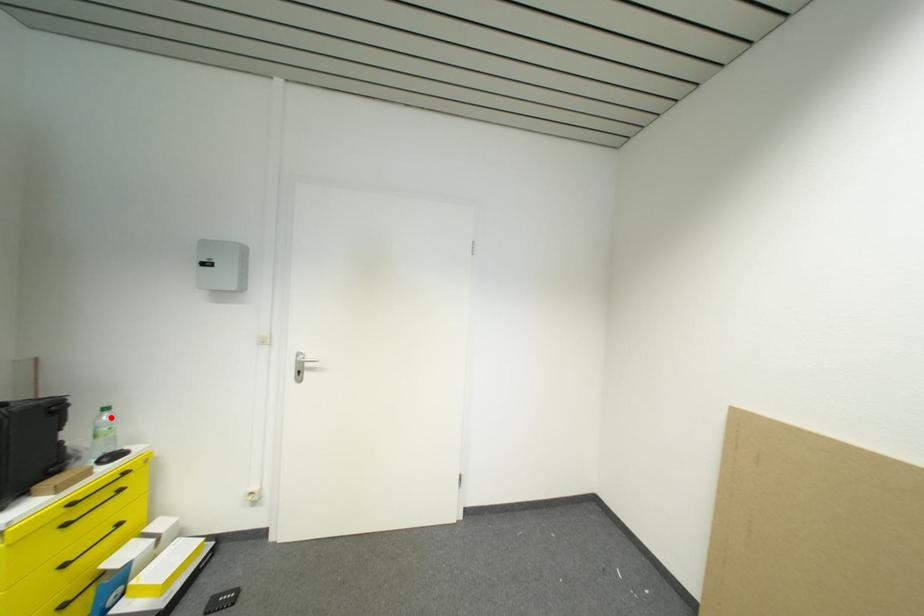
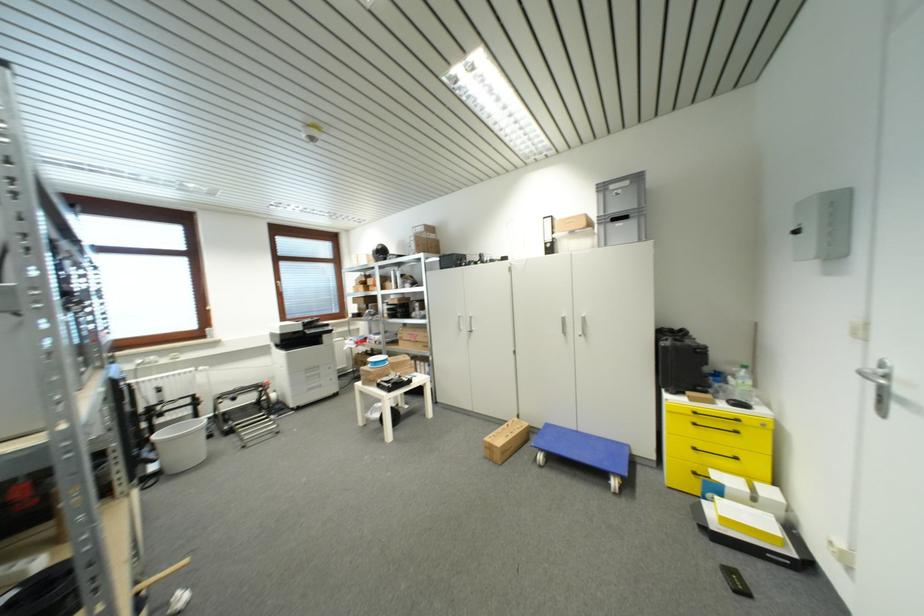
In the second image, find the point that corresponds to the highlighted location in the first image.

(748, 374)